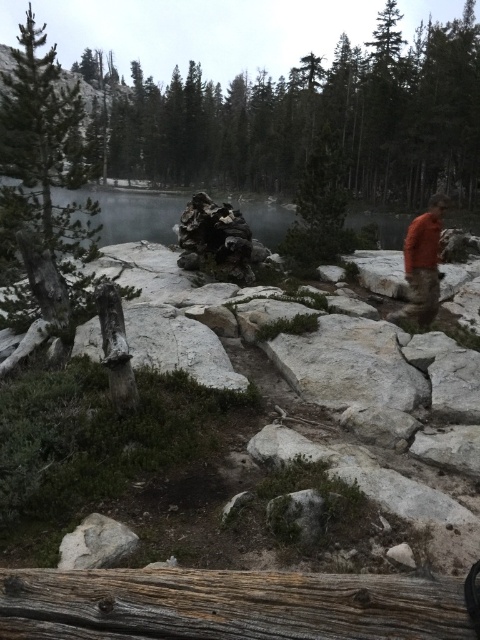
Question: Which of the following is the farthest from the observer?

Choices:
 (A) (442, 593)
 (B) (441, 228)

Answer: (B)

Question: Which is nearer to the weathered brown wood log at lower center?

Choices:
 (A) clear water at lake center
 (B) dark green textured tree at left

Answer: (B)

Question: Does dark green textured tree at left have a lesser width compared to clear water at lake center?

Choices:
 (A) yes
 (B) no

Answer: (B)

Question: Does weathered brown wood log at lower center come behind dark green textured tree at left?

Choices:
 (A) no
 (B) yes

Answer: (A)

Question: In this image, where is dark green textured tree at left located relative to orange fabric shirt at right?

Choices:
 (A) below
 (B) above

Answer: (B)

Question: Which object is positioned closest to the dark green textured tree at left?

Choices:
 (A) weathered brown wood log at lower center
 (B) clear water at lake center

Answer: (A)